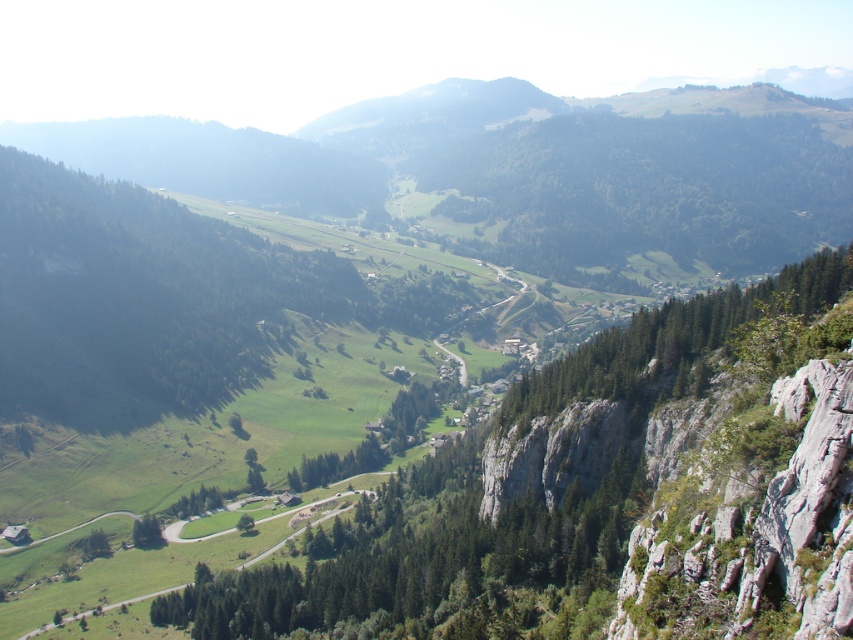
Is point (523, 124) farther from viewer compared to point (155, 534)?

Yes, point (523, 124) is behind point (155, 534).

Who is more distant from viewer, (x=740, y=195) or (x=154, y=540)?

The point (x=740, y=195) is more distant.

This screenshot has height=640, width=853. I want to click on green leafy trees at center, so click(648, 188).